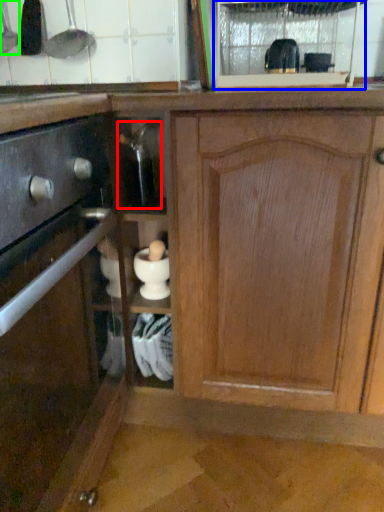
Question: Which object is positioned closest to appliance (highlighted by a red box)? Select from glass door (highlighted by a blue box) and appliance (highlighted by a green box).

Choices:
 (A) glass door
 (B) appliance

Answer: (B)